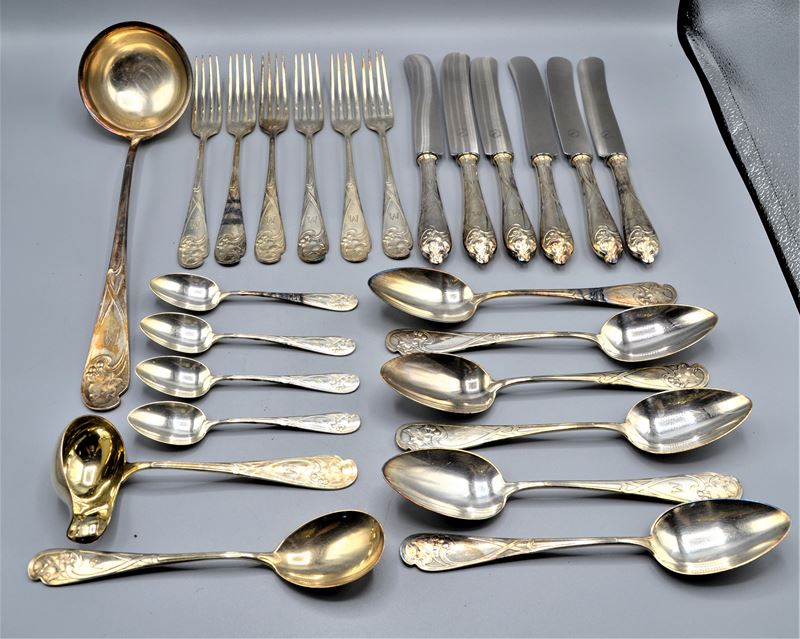
Locate an element on the screen. Image resolution: width=800 pixels, height=639 pixels. larger spoons is located at coordinates (418, 289), (658, 337), (678, 424), (466, 387), (690, 528), (464, 497).